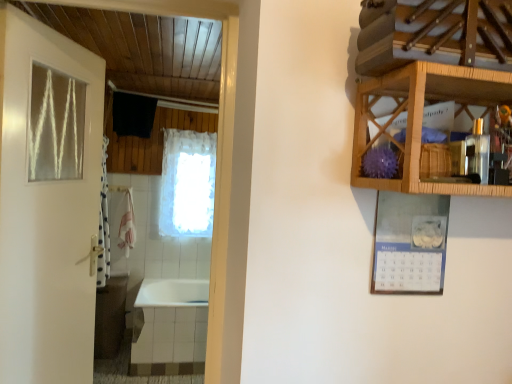
Question: Is white glossy bathtub at lower left bigger or smaller than white paper calendar at upper right?

Choices:
 (A) big
 (B) small

Answer: (A)

Question: In the image, is white glossy bathtub at lower left positioned in front of or behind white paper calendar at upper right?

Choices:
 (A) front
 (B) behind

Answer: (B)

Question: Which object is positioned closest to the white glossy door at left?

Choices:
 (A) white glossy bathtub at lower left
 (B) clear glass window at upper left
 (C) wooden cabinet at upper right
 (D) white paper calendar at upper right
 (E) pink fabric towel at left

Answer: (B)

Question: Considering the real-world distances, which object is farthest from the white glossy door at left?

Choices:
 (A) white paper calendar at upper right
 (B) wooden cabinet at upper right
 (C) white lace curtain at center
 (D) white glossy bathtub at lower left
 (E) clear glass window at upper left

Answer: (C)